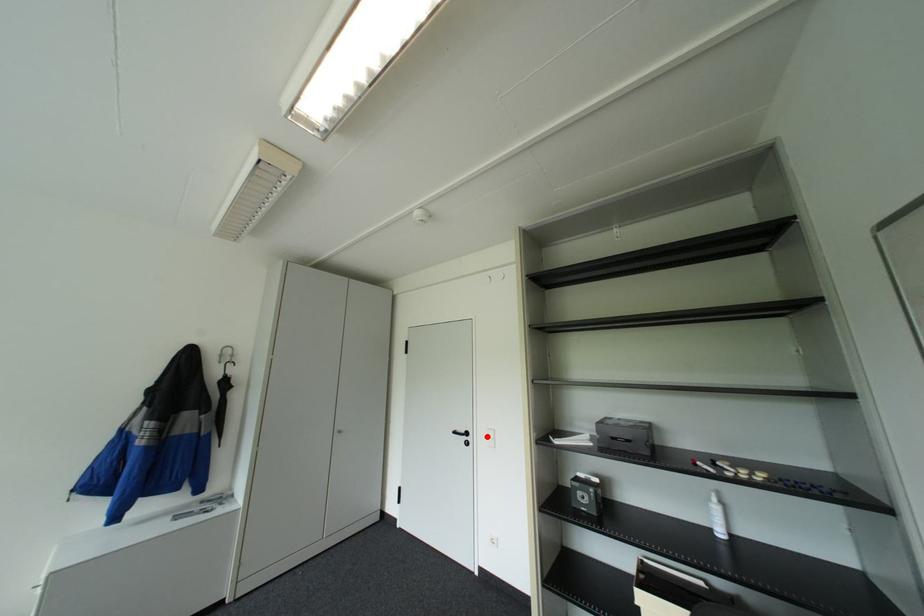
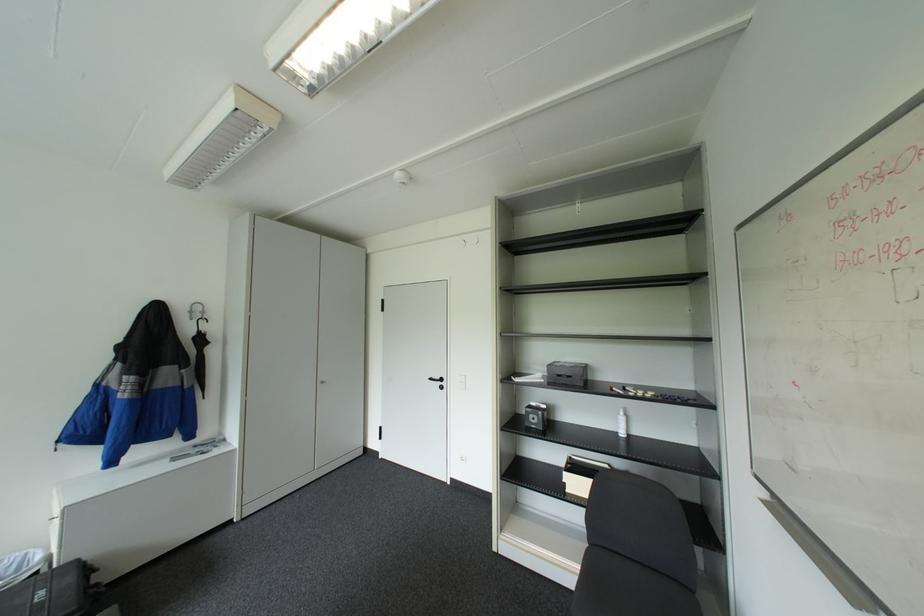
Where in the second image is the point corresponding to the highlighted location from the first image?

(459, 381)